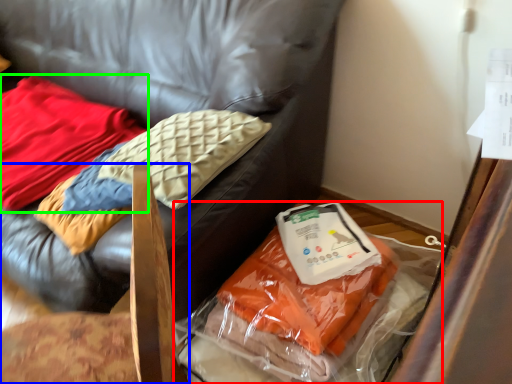
Question: Considering the real-world distances, which object is farthest from waste (highlighted by a red box)? furniture (highlighted by a blue box) or pillow (highlighted by a green box)?

Choices:
 (A) furniture
 (B) pillow

Answer: (B)